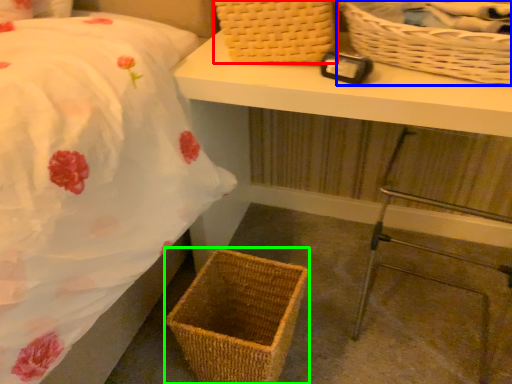
Question: Which object is positioned closest to picnic basket (highlighted by a red box)? Select from picnic basket (highlighted by a blue box) and picnic basket (highlighted by a green box).

Choices:
 (A) picnic basket
 (B) picnic basket

Answer: (A)